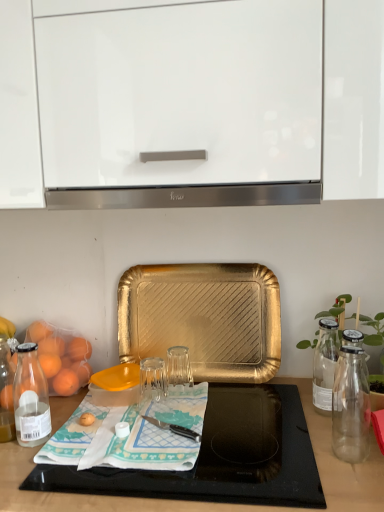
Locate an element on the screen. This screenshot has height=512, width=384. vacant area on top of transparent plastic cutting board at lower center (from a real-world perspective) is located at coordinates (190, 438).